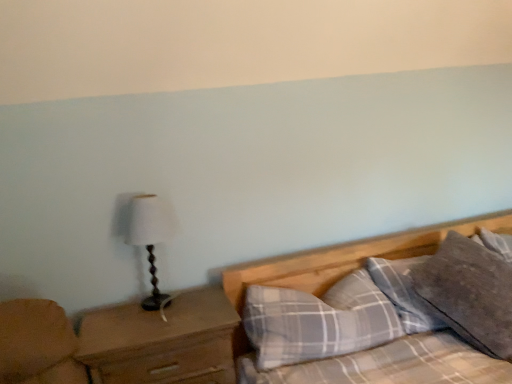
This screenshot has height=384, width=512. In order to click on wooden table lamp at left in this screenshot , I will do `click(150, 238)`.

Find the location of `plaid fabric pillow at lower right, arranged as the 2th pillow when viewed from the right`. plaid fabric pillow at lower right, arranged as the 2th pillow when viewed from the right is located at coordinates (318, 321).

Describe the element at coordinates (318, 321) in the screenshot. I see `plaid fabric pillow at lower right, the 1th pillow viewed from the left` at that location.

Identify the location of gray cotton pillow at upper right, the 2th pillow when ordered from left to right. Image resolution: width=512 pixels, height=384 pixels. (469, 293).

Find the location of a particular element. The width and height of the screenshot is (512, 384). brown wooden nightstand at left is located at coordinates (163, 341).

From the image's perspective, would you say gray cotton pillow at upper right, the 2th pillow when ordered from left to right, is positioned over wooden table lamp at left?

No.

Is gray cotton pillow at upper right, which is counted as the first pillow, starting from the right, further to the viewer compared to wooden table lamp at left?

Yes, gray cotton pillow at upper right, which is counted as the first pillow, starting from the right, is behind wooden table lamp at left.

Which object is thinner, gray cotton pillow at upper right, the 2th pillow when ordered from left to right, or wooden table lamp at left?

Thinner between the two is wooden table lamp at left.

Is gray cotton pillow at upper right, which is counted as the first pillow, starting from the right, oriented away from wooden table lamp at left?

That's not correct — gray cotton pillow at upper right, which is counted as the first pillow, starting from the right, is not looking away from wooden table lamp at left.

Which object is closer to the camera taking this photo, plaid fabric pillow at lower right, arranged as the 2th pillow when viewed from the right, or gray cotton pillow at upper right, which is counted as the first pillow, starting from the right?

plaid fabric pillow at lower right, arranged as the 2th pillow when viewed from the right.

Which is behind, point (259, 353) or point (508, 324)?

The point (259, 353) is more distant.

Is plaid fabric pillow at lower right, arranged as the 2th pillow when viewed from the right, facing towards gray cotton pillow at upper right, the 2th pillow when ordered from left to right?

No, plaid fabric pillow at lower right, arranged as the 2th pillow when viewed from the right, does not turn towards gray cotton pillow at upper right, the 2th pillow when ordered from left to right.

Relative to plaid fabric pillow at lower right, the 1th pillow viewed from the left, is gray cotton pillow at upper right, which is counted as the first pillow, starting from the right, in front or behind?

gray cotton pillow at upper right, which is counted as the first pillow, starting from the right, is positioned farther from the viewer than plaid fabric pillow at lower right, the 1th pillow viewed from the left.

Considering the relative sizes of gray cotton pillow at upper right, which is counted as the first pillow, starting from the right, and plaid fabric pillow at lower right, arranged as the 2th pillow when viewed from the right, in the image provided, is gray cotton pillow at upper right, which is counted as the first pillow, starting from the right, taller than plaid fabric pillow at lower right, arranged as the 2th pillow when viewed from the right,?

No.

Can plaid fabric pillow at lower right, arranged as the 2th pillow when viewed from the right, be found inside gray cotton pillow at upper right, the 2th pillow when ordered from left to right?

No, plaid fabric pillow at lower right, arranged as the 2th pillow when viewed from the right, is not a part of gray cotton pillow at upper right, the 2th pillow when ordered from left to right.

Which is behind, point (483, 261) or point (270, 298)?

The point (483, 261) is more distant.

Do you think wooden table lamp at left is within gray cotton pillow at upper right, which is counted as the first pillow, starting from the right, or outside of it?

wooden table lamp at left cannot be found inside gray cotton pillow at upper right, which is counted as the first pillow, starting from the right.

Would you say wooden table lamp at left is a long distance from gray cotton pillow at upper right, the 2th pillow when ordered from left to right?

wooden table lamp at left is positioned a significant distance from gray cotton pillow at upper right, the 2th pillow when ordered from left to right.

From their relative heights in the image, would you say wooden table lamp at left is taller or shorter than gray cotton pillow at upper right, which is counted as the first pillow, starting from the right?

wooden table lamp at left is taller than gray cotton pillow at upper right, which is counted as the first pillow, starting from the right.

Based on their positions, is wooden table lamp at left located to the left or right of gray cotton pillow at upper right, the 2th pillow when ordered from left to right?

From the image, it's evident that wooden table lamp at left is to the left of gray cotton pillow at upper right, the 2th pillow when ordered from left to right.

Are brown wooden nightstand at left and wooden table lamp at left beside each other?

brown wooden nightstand at left is not next to wooden table lamp at left, and they're not touching.

Can you confirm if brown wooden nightstand at left is positioned to the left of wooden table lamp at left?

No.

Between brown wooden nightstand at left and wooden table lamp at left, which one has smaller size?

With smaller size is wooden table lamp at left.

Measure the distance from plaid fabric pillow at lower right, arranged as the 2th pillow when viewed from the right, to wooden table lamp at left.

The distance of plaid fabric pillow at lower right, arranged as the 2th pillow when viewed from the right, from wooden table lamp at left is 22.92 inches.

Considering the sizes of plaid fabric pillow at lower right, arranged as the 2th pillow when viewed from the right, and wooden table lamp at left in the image, is plaid fabric pillow at lower right, arranged as the 2th pillow when viewed from the right, wider or thinner than wooden table lamp at left?

In the image, plaid fabric pillow at lower right, arranged as the 2th pillow when viewed from the right, appears to be wider than wooden table lamp at left.

From a real-world perspective, between plaid fabric pillow at lower right, arranged as the 2th pillow when viewed from the right, and wooden table lamp at left, who is vertically higher?

wooden table lamp at left is physically above.

Who is taller, plaid fabric pillow at lower right, the 1th pillow viewed from the left, or wooden table lamp at left?

With more height is wooden table lamp at left.

From a real-world perspective, is brown wooden nightstand at left above or below gray cotton pillow at upper right, the 2th pillow when ordered from left to right?

Clearly, from a real-world perspective, brown wooden nightstand at left is below gray cotton pillow at upper right, the 2th pillow when ordered from left to right.

Can you tell me how much brown wooden nightstand at left and gray cotton pillow at upper right, which is counted as the first pillow, starting from the right, differ in facing direction?

brown wooden nightstand at left and gray cotton pillow at upper right, which is counted as the first pillow, starting from the right, are facing 1.45 degrees away from each other.

Based on the photo, considering the sizes of objects brown wooden nightstand at left and gray cotton pillow at upper right, which is counted as the first pillow, starting from the right, in the image provided, who is taller, brown wooden nightstand at left or gray cotton pillow at upper right, which is counted as the first pillow, starting from the right,?

brown wooden nightstand at left is taller.

How much distance is there between brown wooden nightstand at left and gray cotton pillow at upper right, which is counted as the first pillow, starting from the right?

brown wooden nightstand at left and gray cotton pillow at upper right, which is counted as the first pillow, starting from the right, are 97.42 centimeters apart.

Starting from the wooden table lamp at left, which pillow is the 2nd one to the right? Please provide its 2D coordinates.

[(469, 293)]

Find the location of `pillow behind the plaid fabric pillow at lower right, the 1th pillow viewed from the left`. pillow behind the plaid fabric pillow at lower right, the 1th pillow viewed from the left is located at coordinates (469, 293).

From the image, which object appears to be nearer to brown wooden nightstand at left, wooden table lamp at left or gray cotton pillow at upper right, which is counted as the first pillow, starting from the right?

wooden table lamp at left is positioned closer to the anchor brown wooden nightstand at left.

Based on the photo, which object lies nearer to the anchor point plaid fabric pillow at lower right, arranged as the 2th pillow when viewed from the right, wooden table lamp at left or gray cotton pillow at upper right, the 2th pillow when ordered from left to right?

gray cotton pillow at upper right, the 2th pillow when ordered from left to right.

When comparing their distances from gray cotton pillow at upper right, the 2th pillow when ordered from left to right, does plaid fabric pillow at lower right, the 1th pillow viewed from the left, or brown wooden nightstand at left seem further?

The object further to gray cotton pillow at upper right, the 2th pillow when ordered from left to right, is brown wooden nightstand at left.

From the image, which object appears to be farther from gray cotton pillow at upper right, which is counted as the first pillow, starting from the right, wooden table lamp at left or plaid fabric pillow at lower right, arranged as the 2th pillow when viewed from the right?

Among the two, wooden table lamp at left is located further to gray cotton pillow at upper right, which is counted as the first pillow, starting from the right.

Looking at the image, which one is located further to wooden table lamp at left, gray cotton pillow at upper right, which is counted as the first pillow, starting from the right, or plaid fabric pillow at lower right, the 1th pillow viewed from the left?

Among the two, gray cotton pillow at upper right, which is counted as the first pillow, starting from the right, is located further to wooden table lamp at left.

Which object lies further to the anchor point plaid fabric pillow at lower right, arranged as the 2th pillow when viewed from the right, brown wooden nightstand at left or gray cotton pillow at upper right, the 2th pillow when ordered from left to right?

gray cotton pillow at upper right, the 2th pillow when ordered from left to right, lies further to plaid fabric pillow at lower right, arranged as the 2th pillow when viewed from the right, than the other object.

Looking at the image, which one is located further to gray cotton pillow at upper right, the 2th pillow when ordered from left to right, brown wooden nightstand at left or wooden table lamp at left?

wooden table lamp at left is further to gray cotton pillow at upper right, the 2th pillow when ordered from left to right.

From the image, which object appears to be nearer to brown wooden nightstand at left, gray cotton pillow at upper right, which is counted as the first pillow, starting from the right, or plaid fabric pillow at lower right, arranged as the 2th pillow when viewed from the right?

plaid fabric pillow at lower right, arranged as the 2th pillow when viewed from the right, lies closer to brown wooden nightstand at left than the other object.

This screenshot has width=512, height=384. What are the coordinates of `pillow situated between wooden table lamp at left and gray cotton pillow at upper right, which is counted as the first pillow, starting from the right, from left to right` in the screenshot? It's located at (318, 321).

Identify the location of nightstand situated between wooden table lamp at left and plaid fabric pillow at lower right, arranged as the 2th pillow when viewed from the right, from left to right. The width and height of the screenshot is (512, 384). (163, 341).

Identify the location of nightstand between wooden table lamp at left and gray cotton pillow at upper right, which is counted as the first pillow, starting from the right, in the horizontal direction. The width and height of the screenshot is (512, 384). (163, 341).

Where is `pillow situated between brown wooden nightstand at left and gray cotton pillow at upper right, which is counted as the first pillow, starting from the right, from left to right`? Image resolution: width=512 pixels, height=384 pixels. pillow situated between brown wooden nightstand at left and gray cotton pillow at upper right, which is counted as the first pillow, starting from the right, from left to right is located at coordinates (318, 321).